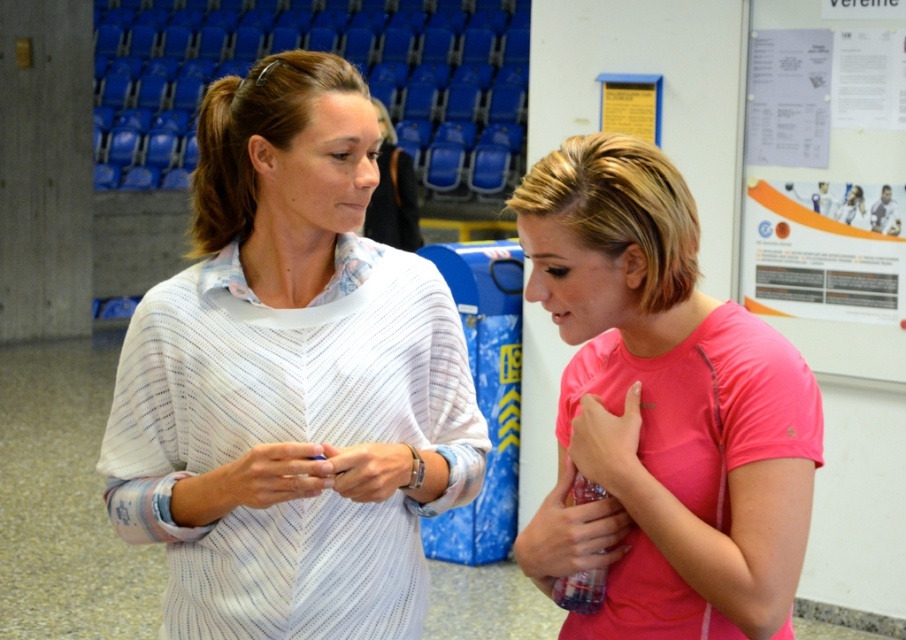
You are a photographer setting up for a group photo. You notice two items in the scene that are both white and at the center of the image. The items are the white textured shirt at center and the matte white wristband at center. Which one is positioned higher?

The white textured shirt at center is above the matte white wristband at center, so the white textured shirt at center is positioned higher.

You are designing a uniform for a sports team and need to ensure that the shirt and hand coverings fit properly. Given the image, will the pink matte shirt at center and the pink fabric hand at center be proportional in size when worn by the same person?

The pink matte shirt at center has a larger size compared to the pink fabric hand at center, so they are not proportional in size when worn by the same person.

In the scene shown: You are a photographer setting up a shoot in the scene. You want to focus on the white textured shirt at center and the matte white wristband at center. Which object will appear larger in your camera frame?

The white textured shirt at center will appear larger in the camera frame because it is closer to the viewer than the matte white wristband at center.